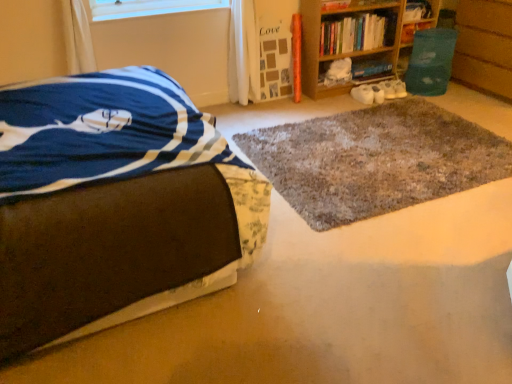
Question: Considering the relative positions of hardcover book at upper right, the second book in the right-to-left sequence, and hardcover book at upper right, which appears as the 1th book when viewed from the right, in the image provided, is hardcover book at upper right, the second book in the right-to-left sequence, to the left of hardcover book at upper right, which appears as the 1th book when viewed from the right, from the viewer's perspective?

Choices:
 (A) no
 (B) yes

Answer: (B)

Question: Is hardcover book at upper right, the second book in the right-to-left sequence, bigger than hardcover book at upper right, which is the 4th book in left-to-right order?

Choices:
 (A) yes
 (B) no

Answer: (A)

Question: From a real-world perspective, is hardcover book at upper right, positioned as the third book in left-to-right order, positioned over hardcover book at upper right, which appears as the 1th book when viewed from the right, based on gravity?

Choices:
 (A) yes
 (B) no

Answer: (B)

Question: Is hardcover book at upper right, positioned as the third book in left-to-right order, with hardcover book at upper right, which is the 4th book in left-to-right order?

Choices:
 (A) yes
 (B) no

Answer: (B)

Question: Is hardcover book at upper right, positioned as the third book in left-to-right order, taller than hardcover book at upper right, which is the 4th book in left-to-right order?

Choices:
 (A) yes
 (B) no

Answer: (B)

Question: Considering the positions of shaggy gray rug at center and hardcover book at upper right, the second book in the right-to-left sequence, in the image, is shaggy gray rug at center wider or thinner than hardcover book at upper right, the second book in the right-to-left sequence,?

Choices:
 (A) wide
 (B) thin

Answer: (A)

Question: From the image's perspective, is shaggy gray rug at center located above or below hardcover book at upper right, the second book in the right-to-left sequence?

Choices:
 (A) below
 (B) above

Answer: (A)

Question: From a real-world perspective, is shaggy gray rug at center physically located above or below hardcover book at upper right, positioned as the third book in left-to-right order?

Choices:
 (A) below
 (B) above

Answer: (A)

Question: Considering the positions of shaggy gray rug at center and hardcover book at upper right, the second book in the right-to-left sequence, in the image, is shaggy gray rug at center taller or shorter than hardcover book at upper right, the second book in the right-to-left sequence,?

Choices:
 (A) tall
 (B) short

Answer: (B)

Question: Does point (92, 289) appear closer or farther from the camera than point (381, 36)?

Choices:
 (A) farther
 (B) closer

Answer: (B)

Question: Considering the positions of brown fabric bed at left and wooden bookshelf at upper right, the 4th book positioned from the right, in the image, is brown fabric bed at left wider or thinner than wooden bookshelf at upper right, the 4th book positioned from the right,?

Choices:
 (A) wide
 (B) thin

Answer: (A)

Question: Considering their positions, is brown fabric bed at left located in front of or behind wooden bookshelf at upper right, which appears as the first book when viewed from the left?

Choices:
 (A) behind
 (B) front

Answer: (B)

Question: Considering the positions of brown fabric bed at left and wooden bookshelf at upper right, the 4th book positioned from the right, in the image, is brown fabric bed at left taller or shorter than wooden bookshelf at upper right, the 4th book positioned from the right,?

Choices:
 (A) short
 (B) tall

Answer: (B)

Question: Considering the positions of point (487, 41) and point (413, 36), is point (487, 41) closer or farther from the camera than point (413, 36)?

Choices:
 (A) farther
 (B) closer

Answer: (B)

Question: Is green plastic bin at right to the left or to the right of hardcover book at upper right, the second book in the right-to-left sequence, in the image?

Choices:
 (A) right
 (B) left

Answer: (A)